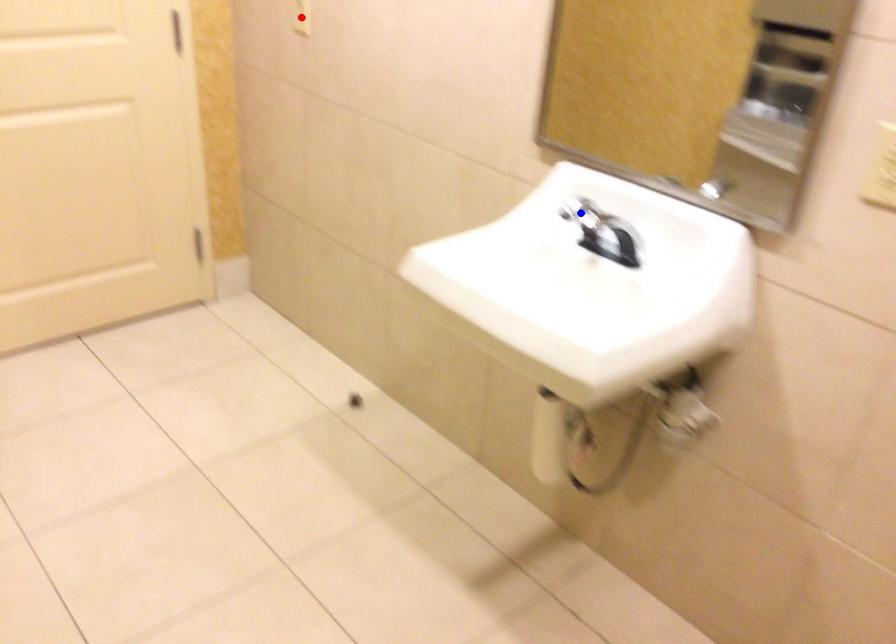
Question: In the image, two points are highlighted. Which point is nearer to the camera? Reply with the corresponding letter.

Choices:
 (A) blue point
 (B) red point

Answer: (A)